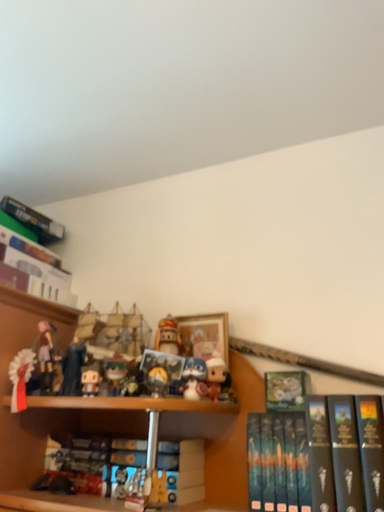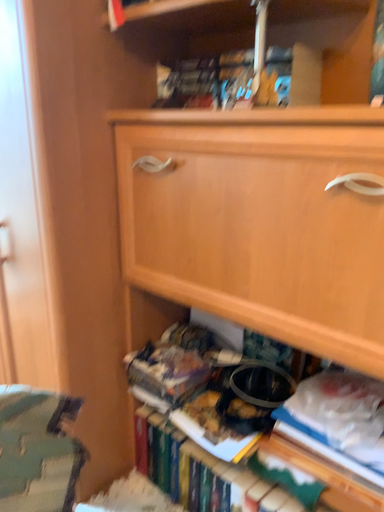
Question: How did the camera likely rotate when shooting the video?

Choices:
 (A) rotated right
 (B) rotated left

Answer: (B)